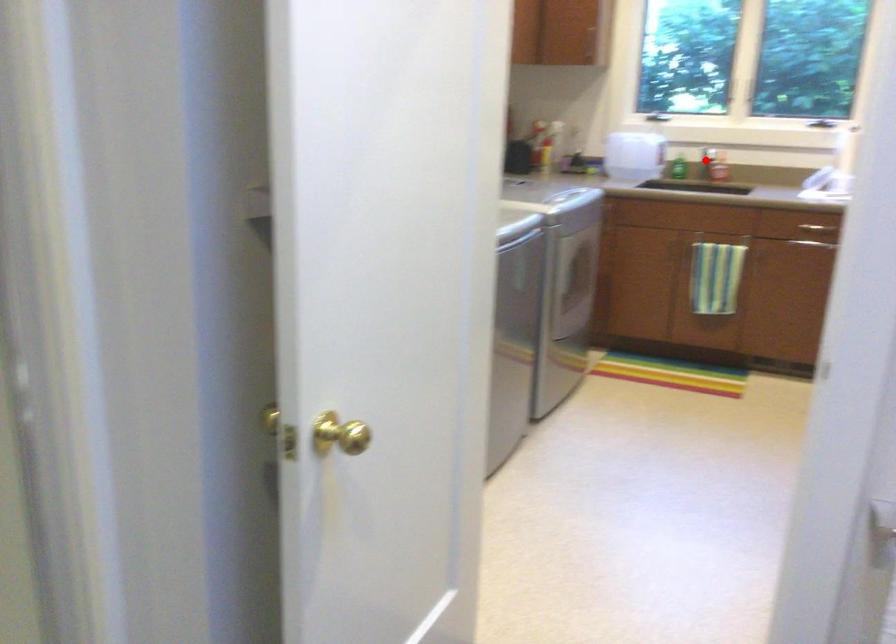
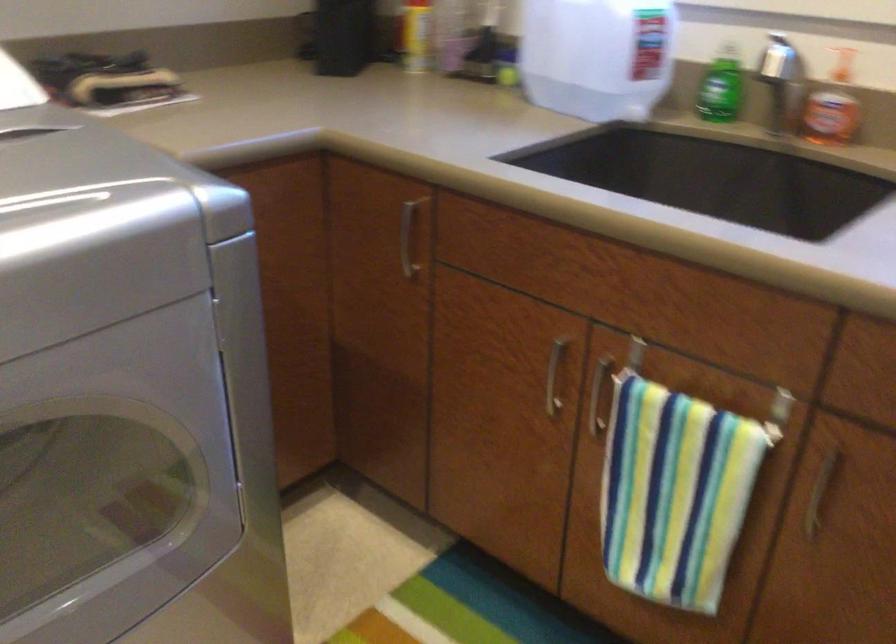
The point at the highlighted location is marked in the first image. Where is the corresponding point in the second image?

(788, 96)